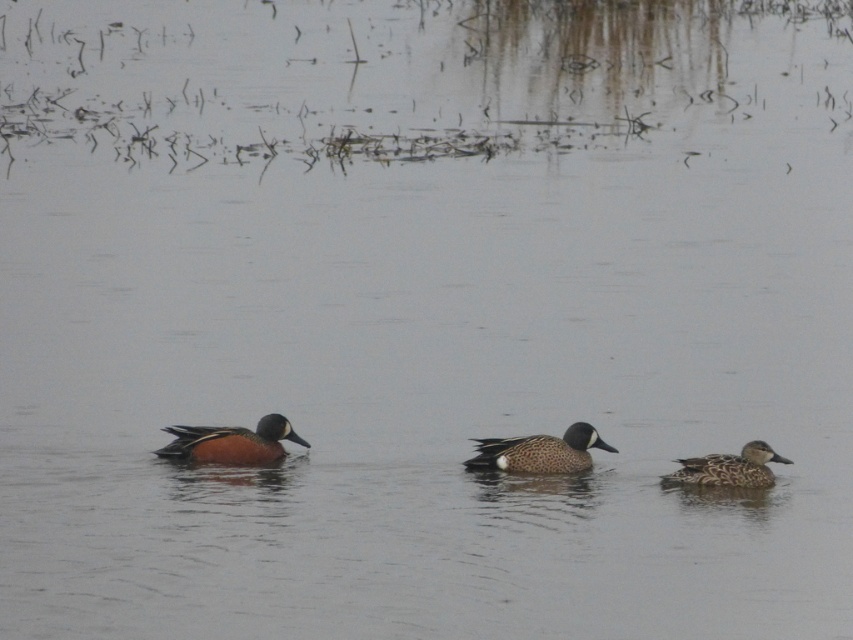
Is speckled feathered duck at center wider than speckled brown duck at right?

Yes.

At what (x,y) coordinates should I click in order to perform the action: click on speckled feathered duck at center. Please return your answer as a coordinate pair (x, y). The width and height of the screenshot is (853, 640). Looking at the image, I should click on (538, 451).

Find the location of a particular element. This screenshot has height=640, width=853. speckled feathered duck at center is located at coordinates (538, 451).

Which is above, blue speckled duck at left or speckled brown duck at right?

Positioned higher is blue speckled duck at left.

Is point (305, 444) less distant than point (747, 444)?

No, it is not.

The image size is (853, 640). What are the coordinates of `blue speckled duck at left` in the screenshot? It's located at (231, 442).

Between blue speckled duck at left and speckled feathered duck at center, which one has more height?

With more height is speckled feathered duck at center.

From the picture: Between blue speckled duck at left and speckled feathered duck at center, which one is positioned higher?

Positioned higher is blue speckled duck at left.

What do you see at coordinates (231, 442) in the screenshot? This screenshot has height=640, width=853. I see `blue speckled duck at left` at bounding box center [231, 442].

At what (x,y) coordinates should I click in order to perform the action: click on blue speckled duck at left. Please return your answer as a coordinate pair (x, y). This screenshot has width=853, height=640. Looking at the image, I should click on (231, 442).